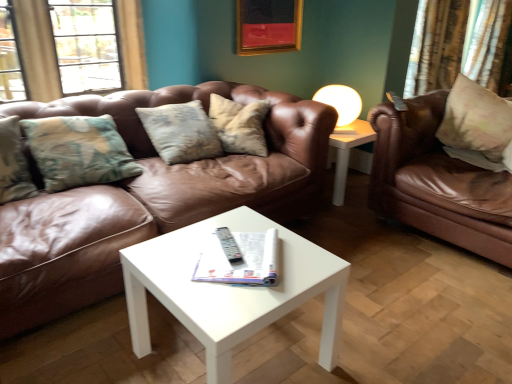
This screenshot has width=512, height=384. Identify the location of free space to the right of white glossy coffee table at center. (362, 334).